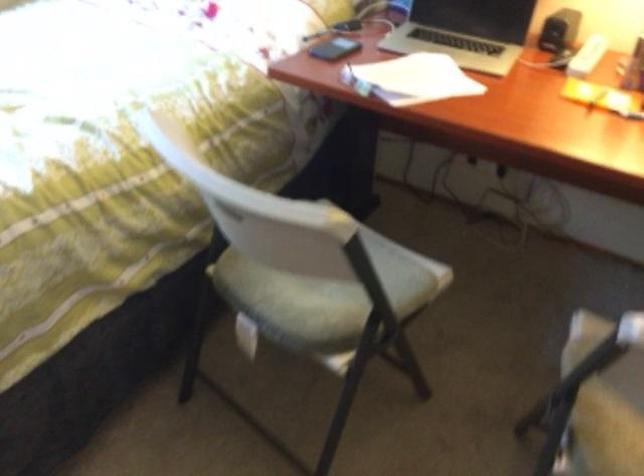
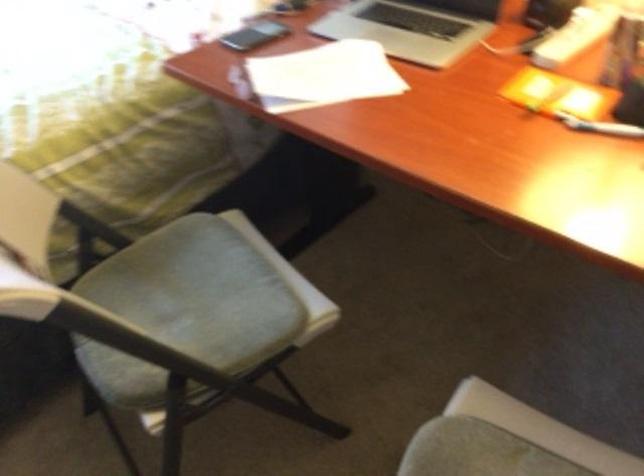
Question: The camera is either moving clockwise (left) or counter-clockwise (right) around the object. The first image is from the beginning of the video and the second image is from the end. Is the camera moving left or right when shooting the video?

Choices:
 (A) Left
 (B) Right

Answer: (B)